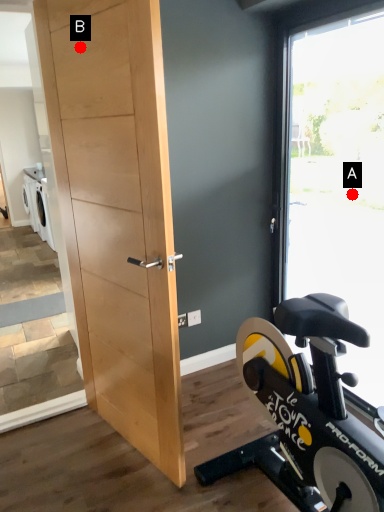
Question: Two points are circled on the image, labeled by A and B beside each circle. Which point appears closest to the camera in this image?

Choices:
 (A) A is closer
 (B) B is closer

Answer: (B)